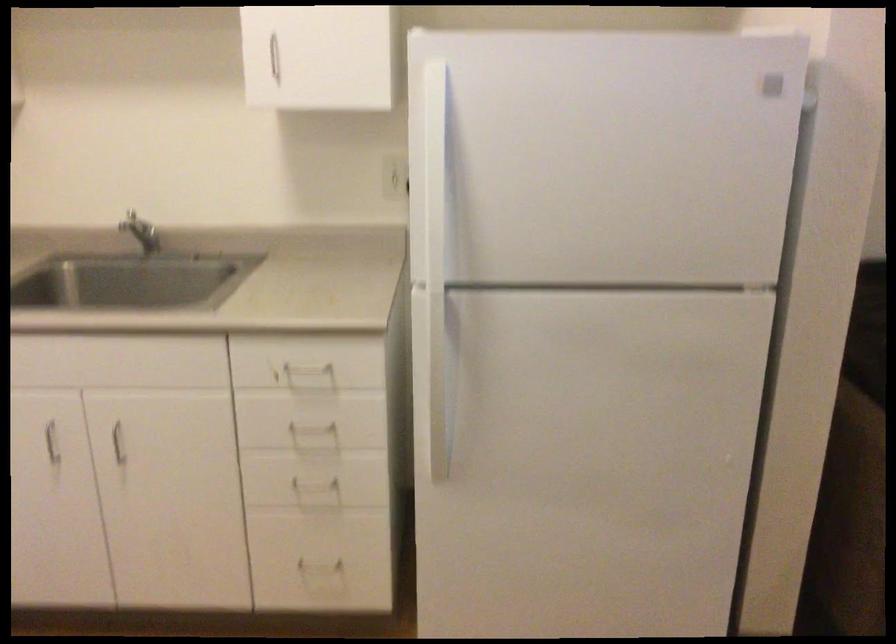
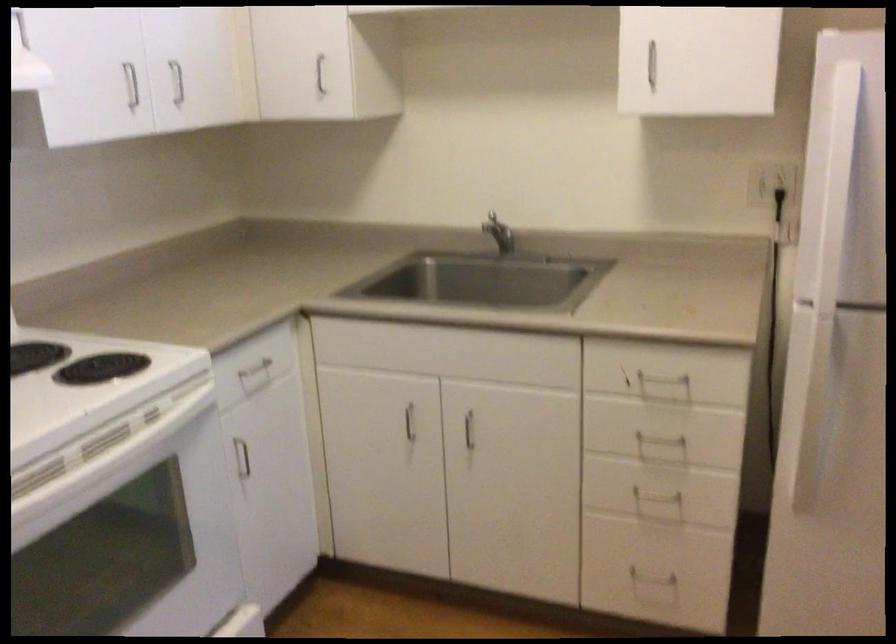
Question: Based on the continuous images, in which direction is the camera rotating? Reply with the corresponding letter.

Choices:
 (A) Left
 (B) Right
 (C) Up
 (D) Down

Answer: (A)